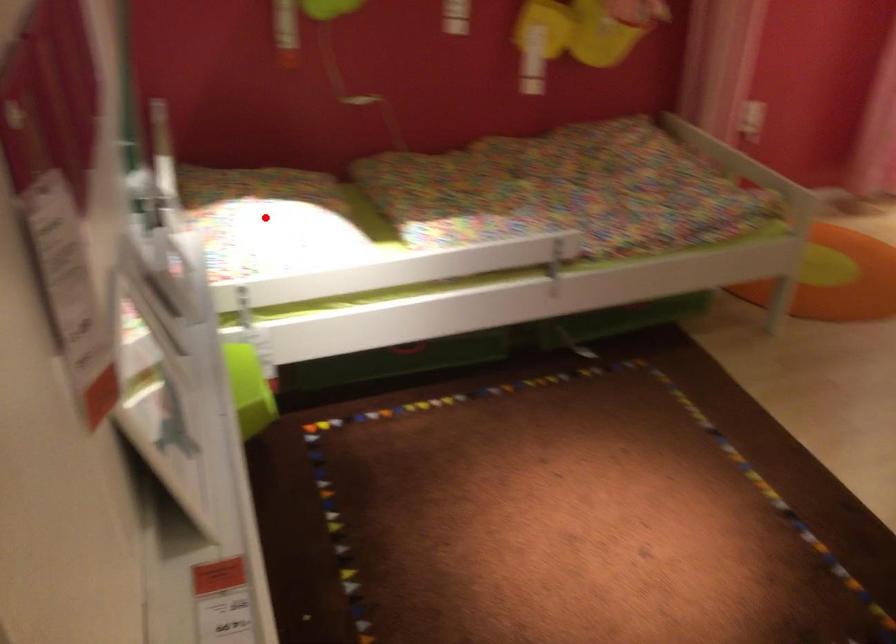
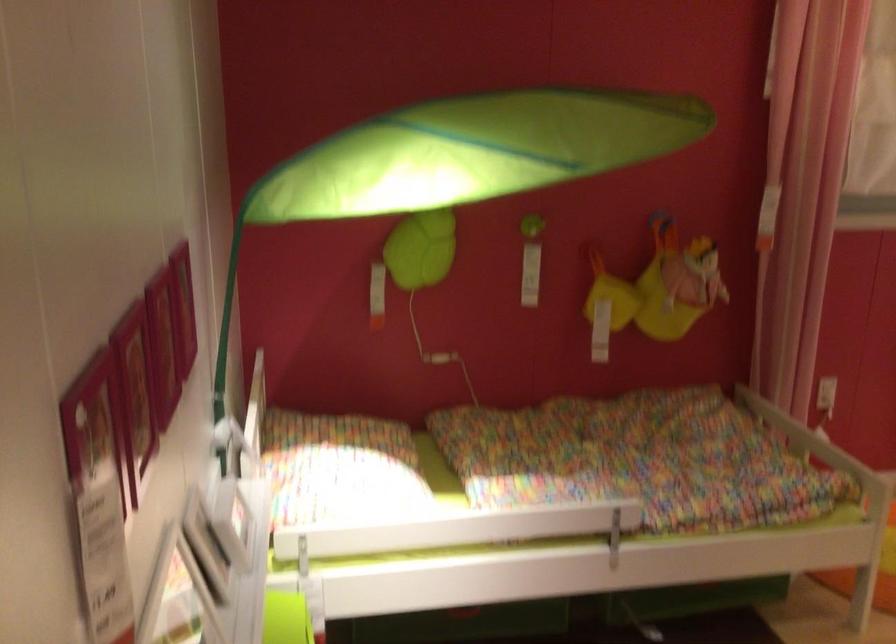
Question: I am providing you with two images of the same scene from different viewpoints. A red point is marked on the first image. Can you still see the location of the red point in image 2?

Choices:
 (A) Yes
 (B) No

Answer: (A)